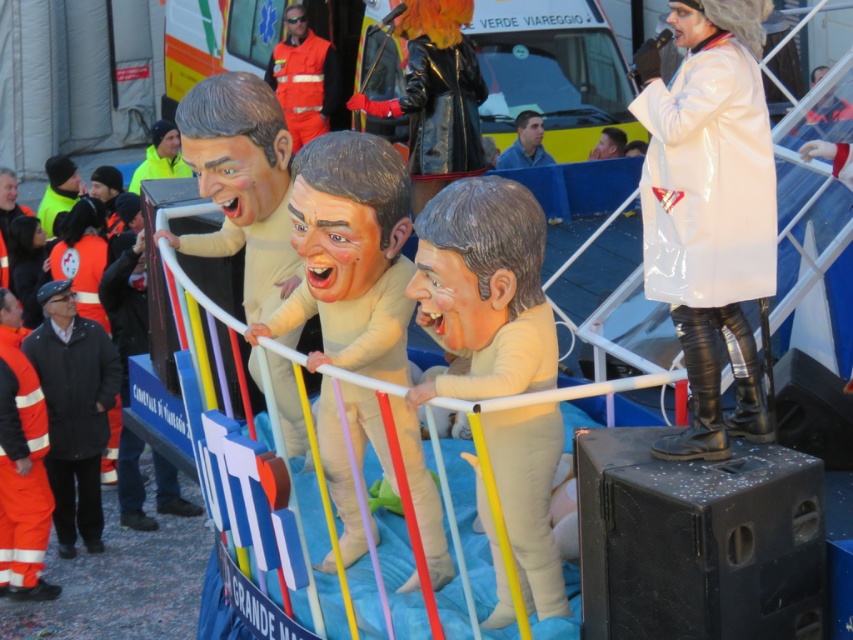
Consider the image. You are a delivery robot with a 1.2 meter wide package. You need to navigate between the shiny white coat at center and the smooth beige mask at center. Can your package fit through the space between them?

The distance between the shiny white coat at center and the smooth beige mask at center is 1.19 meters, which is slightly narrower than the 1.2 meter wide package. Therefore, the package cannot fit through the space between them.

You are a photographer trying to capture a clear shot of both the smooth beige mask at center and the black fabric jacket at lower left. Since you want both subjects to be fully visible in your photo, which object should you focus on first to ensure it isn t cropped out?

The smooth beige mask at center has a lesser height compared to the black fabric jacket at lower left. Therefore, you should focus on the black fabric jacket at lower left first, as it is taller and might be more likely to be partially cropped if not properly framed.

You are an event organizer trying to decide which coat to use for the mascot costume. The shiny white coat at center and the black fabric jacket at lower left are both available. Based on their sizes, which one would be more suitable for a mascot costume that requires a larger, more imposing presence?

The shiny white coat at center is bigger than the black fabric jacket at lower left, making it more suitable for a mascot costume that requires a larger, more imposing presence.